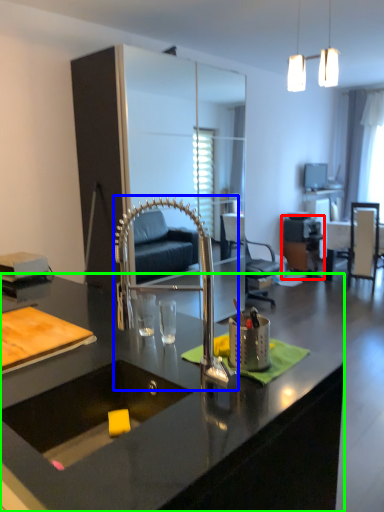
Question: Estimate the real-world distances between objects in this image. Which object is farther from computer desk (highlighted by a red box), faucet (highlighted by a blue box) or desk (highlighted by a green box)?

Choices:
 (A) faucet
 (B) desk

Answer: (B)